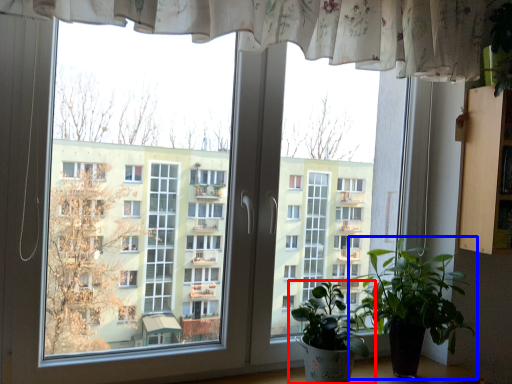
Question: Which object appears farthest to the camera in this image, houseplant (highlighted by a red box) or houseplant (highlighted by a blue box)?

Choices:
 (A) houseplant
 (B) houseplant

Answer: (B)